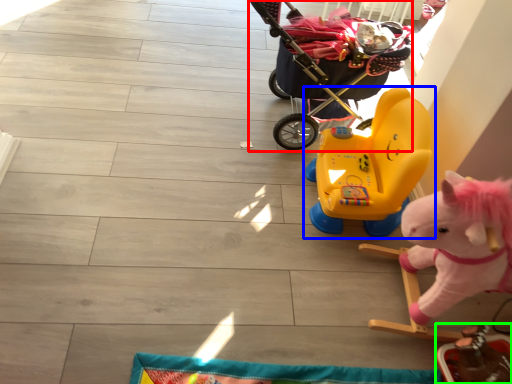
Question: Which is nearer to the baby carriage (highlighted by a red box)? toy (highlighted by a blue box) or toy (highlighted by a green box).

Choices:
 (A) toy
 (B) toy

Answer: (A)